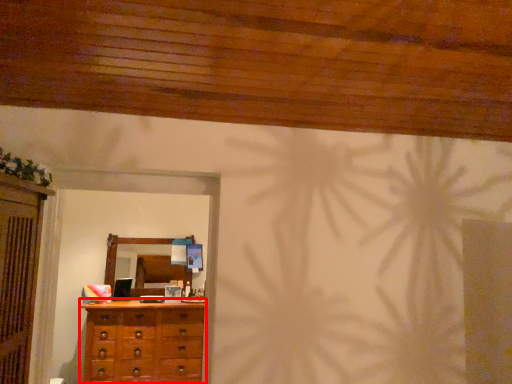
Question: From the image's perspective, considering the relative positions of chest of drawers (annotated by the red box) and mirror in the image provided, where is chest of drawers (annotated by the red box) located with respect to the staircase?

Choices:
 (A) below
 (B) above

Answer: (A)